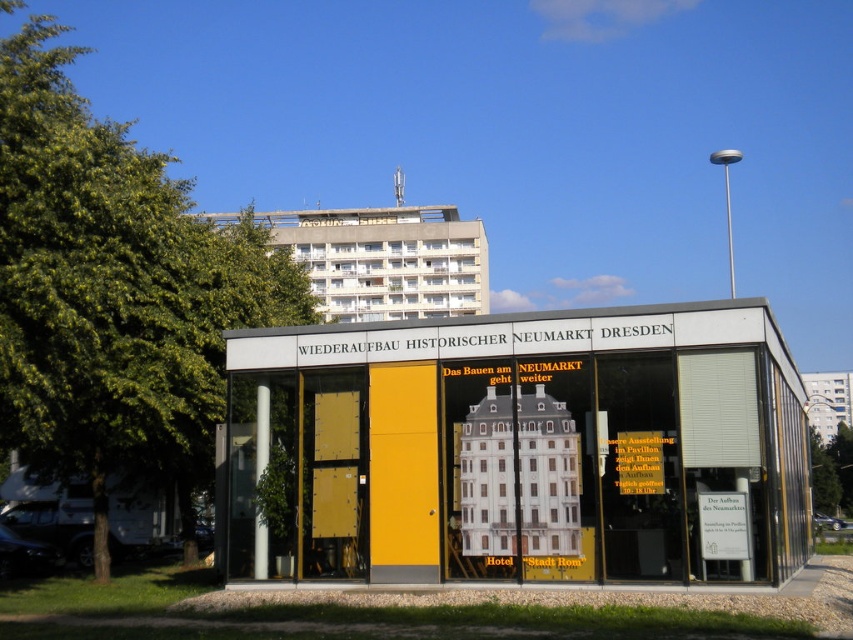
Is green leafy tree at left closer to camera compared to green leafy tree at lower right?

Yes.

Locate an element on the screen. This screenshot has width=853, height=640. green leafy tree at left is located at coordinates (112, 289).

Is green leafy tree at left to the left of green leafy tree at upper left from the viewer's perspective?

Indeed, green leafy tree at left is positioned on the left side of green leafy tree at upper left.

Between green leafy tree at left and green leafy tree at upper left, which one appears on the right side from the viewer's perspective?

green leafy tree at upper left

Image resolution: width=853 pixels, height=640 pixels. Find the location of `green leafy tree at left`. green leafy tree at left is located at coordinates [112, 289].

Can you confirm if green leafy tree at lower right is positioned to the right of green leafy tree at upper left?

Incorrect, green leafy tree at lower right is not on the right side of green leafy tree at upper left.

This screenshot has height=640, width=853. I want to click on green leafy tree at lower right, so pos(831,470).

Between point (820, 483) and point (839, 500), which one is positioned behind?

The point (839, 500) is behind.

You are a GUI agent. You are given a task and a screenshot of the screen. Output one action in this format:
    pyautogui.click(x=<x>, y=<y>)
    Task: Click on the green leafy tree at lower right
    The height and width of the screenshot is (640, 853).
    Given the screenshot: What is the action you would take?
    pyautogui.click(x=831, y=470)